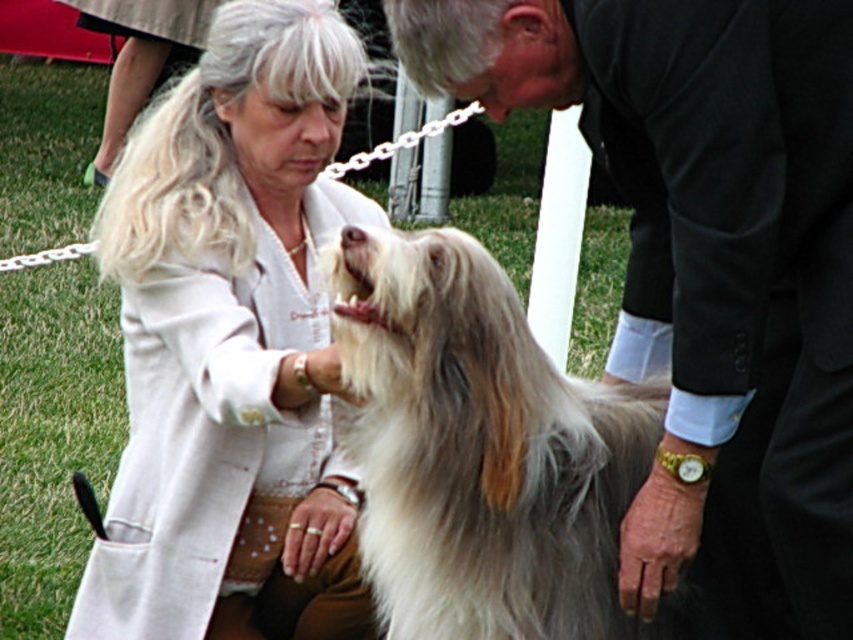
Is the position of fluffy beige dog at center less distant than that of white textured coat at center?

Yes, fluffy beige dog at center is closer to the viewer.

Is fluffy beige dog at center wider than white textured coat at center?

Indeed, fluffy beige dog at center has a greater width compared to white textured coat at center.

Which is in front, point (773, 534) or point (138, 604)?

Point (773, 534) is in front.

Find the location of a particular element. This screenshot has height=640, width=853. fluffy beige dog at center is located at coordinates (706, 268).

Based on the photo, can you confirm if white textured coat at center is positioned above fluffy white dog at center?

Yes, white textured coat at center is above fluffy white dog at center.

Can you confirm if white textured coat at center is taller than fluffy white dog at center?

Correct, white textured coat at center is much taller as fluffy white dog at center.

At what (x,y) coordinates should I click in order to perform the action: click on white textured coat at center. Please return your answer as a coordinate pair (x, y). This screenshot has height=640, width=853. Looking at the image, I should click on (231, 346).

The height and width of the screenshot is (640, 853). What are the coordinates of `white textured coat at center` in the screenshot? It's located at (231, 346).

Which of these two, fluffy beige dog at center or fluffy white dog at center, stands shorter?

With less height is fluffy white dog at center.

Is point (807, 51) behind point (512, 577)?

No.

Who is more distant from viewer, (770, 566) or (496, 600)?

The point (770, 566) is behind.

The height and width of the screenshot is (640, 853). What are the coordinates of `fluffy beige dog at center` in the screenshot? It's located at (706, 268).